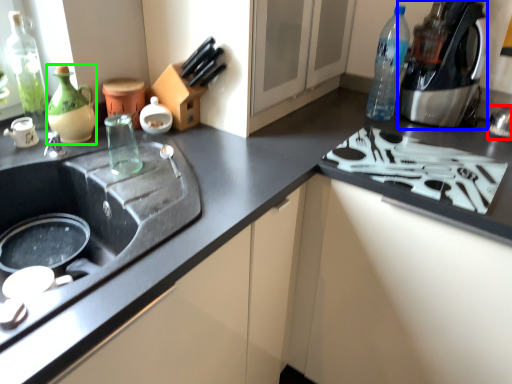
Question: Which object is the closest to the appliance (highlighted by a red box)? Choose among these: coffee machine (highlighted by a blue box) or tea pot (highlighted by a green box).

Choices:
 (A) coffee machine
 (B) tea pot

Answer: (A)